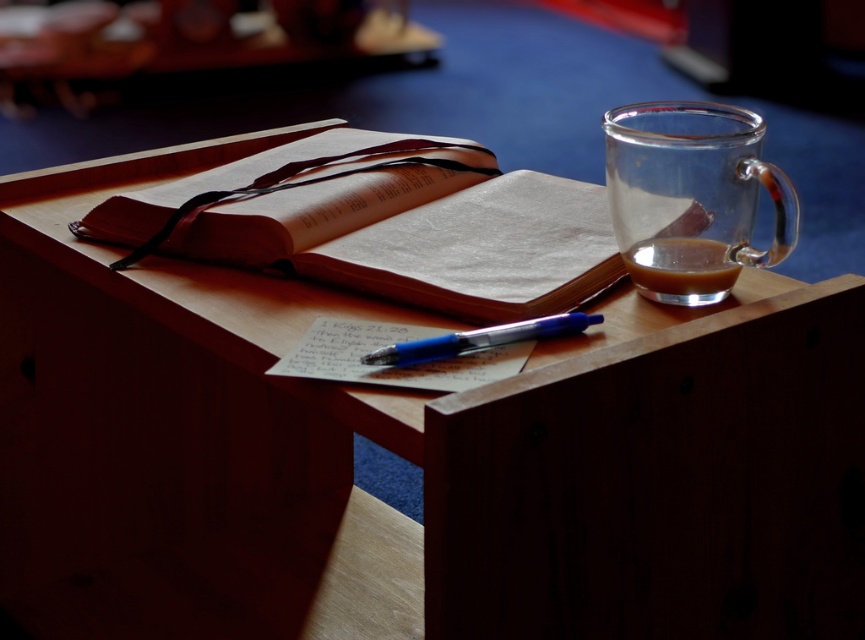
Question: Considering the relative positions of white paper at center and translucent glass mug at upper right in the image provided, where is white paper at center located with respect to translucent glass mug at upper right?

Choices:
 (A) below
 (B) above

Answer: (A)

Question: Observing the image, what is the correct spatial positioning of white paper at center in reference to translucent glass mug at upper right?

Choices:
 (A) above
 (B) below

Answer: (B)

Question: Is white paper at center to the left of translucent glass mug at upper right from the viewer's perspective?

Choices:
 (A) no
 (B) yes

Answer: (B)

Question: Among these objects, which one is nearest to the camera?

Choices:
 (A) blue plastic pen at center
 (B) white paper at center

Answer: (B)

Question: Based on their relative distances, which object is nearer to the translucent glass mug at upper right?

Choices:
 (A) white paper at center
 (B) blue plastic pen at center
 (C) brown leather book at center

Answer: (B)

Question: Among these points, which one is nearest to the camera?

Choices:
 (A) (721, 244)
 (B) (582, 243)

Answer: (A)